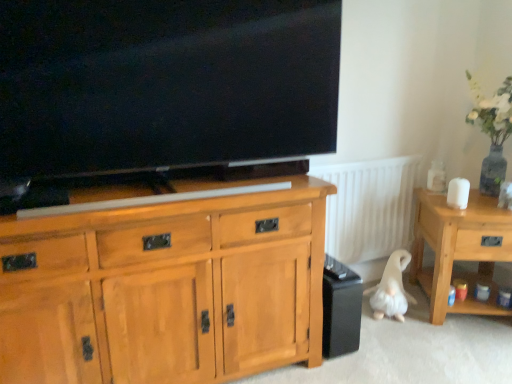
In order to face white plush dog at lower right, should I rotate leftwards or rightwards?

Rotate your view right by about 17.616°.

Measure the distance between point [387,264] and camera.

The distance of point [387,264] from camera is 7.54 feet.

Describe the element at coordinates (459, 249) in the screenshot. I see `light wood side table at right` at that location.

You are a GUI agent. You are given a task and a screenshot of the screen. Output one action in this format:
    pyautogui.click(x=<x>, y=<y>)
    Task: Click on the black matte speaker at lower right
    Image resolution: width=512 pixels, height=384 pixels.
    Given the screenshot: What is the action you would take?
    coord(341,308)

Is matte black tv at upper center placed right next to light brown wood cabinet at center?

No, matte black tv at upper center is not touching light brown wood cabinet at center.

From the image's perspective, relative to light brown wood cabinet at center, is matte black tv at upper center above or below?

matte black tv at upper center is situated higher than light brown wood cabinet at center in the image.

Does matte black tv at upper center appear on the left side of light brown wood cabinet at center?

No.

Can you confirm if matte black tv at upper center is smaller than light brown wood cabinet at center?

Indeed, matte black tv at upper center has a smaller size compared to light brown wood cabinet at center.

Considering the relative sizes of white ribbed radiator at center and light brown wood cabinet at center in the image provided, is white ribbed radiator at center taller than light brown wood cabinet at center?

No, white ribbed radiator at center is not taller than light brown wood cabinet at center.

Is white ribbed radiator at center completely or partially outside of light brown wood cabinet at center?

Yes, white ribbed radiator at center is located beyond the bounds of light brown wood cabinet at center.

Could you tell me if white ribbed radiator at center is turned towards light brown wood cabinet at center?

No, white ribbed radiator at center does not turn towards light brown wood cabinet at center.

Identify the location of cabinetry that is below the white ribbed radiator at center (from the image's perspective). (165, 288).

Consider the image. Considering the relative sizes of white plush dog at lower right and light brown wood cabinet at center in the image provided, is white plush dog at lower right wider than light brown wood cabinet at center?

No.

From the image's perspective, which is above, white plush dog at lower right or light brown wood cabinet at center?

light brown wood cabinet at center appears higher in the image.

Where is `animal on the right of the light brown wood cabinet at center`? animal on the right of the light brown wood cabinet at center is located at coordinates (391, 289).

Is white plush dog at lower right directly adjacent to light brown wood cabinet at center?

No.

Considering the points (368, 220) and (434, 267), which point is behind, point (368, 220) or point (434, 267)?

The point (368, 220) is farther from the camera.

Consider the image. Which object is further away from the camera, white ribbed radiator at center or light wood side table at right?

white ribbed radiator at center is further from the camera.

From the image's perspective, would you say white ribbed radiator at center is shown under light wood side table at right?

No.

Measure the distance between white ribbed radiator at center and light wood side table at right.

white ribbed radiator at center is 13.37 inches away from light wood side table at right.

Considering the sizes of objects light brown wood cabinet at center and matte black tv at upper center in the image provided, who is wider, light brown wood cabinet at center or matte black tv at upper center?

light brown wood cabinet at center is wider.

Is light brown wood cabinet at center oriented away from matte black tv at upper center?

No, light brown wood cabinet at center is not facing the opposite direction of matte black tv at upper center.

Where is `cabinetry below the matte black tv at upper center (from the image's perspective)`? The height and width of the screenshot is (384, 512). cabinetry below the matte black tv at upper center (from the image's perspective) is located at coordinates (165, 288).

Where is `animal to the right of black matte speaker at lower right`? The image size is (512, 384). animal to the right of black matte speaker at lower right is located at coordinates (391, 289).

Is white plush dog at lower right a part of black matte speaker at lower right?

Actually, white plush dog at lower right is outside black matte speaker at lower right.

From the picture: From a real-world perspective, does black matte speaker at lower right sit lower than white plush dog at lower right?

Actually, black matte speaker at lower right is physically above white plush dog at lower right in the real world.

Is black matte speaker at lower right far away from white plush dog at lower right?

black matte speaker at lower right is actually quite close to white plush dog at lower right.

Does light wood side table at right appear on the right side of white plush dog at lower right?

Yes, light wood side table at right is to the right of white plush dog at lower right.

Is light wood side table at right positioned before white plush dog at lower right?

Yes.

Which of these two, light wood side table at right or white plush dog at lower right, is smaller?

With smaller size is white plush dog at lower right.

Between point (461, 212) and point (396, 258), which one is positioned in front?

The point (461, 212) is closer.

You are a GUI agent. You are given a task and a screenshot of the screen. Output one action in this format:
    pyautogui.click(x=<x>, y=<y>)
    Task: Click on the television in front of the light brown wood cabinet at center
    Image resolution: width=512 pixels, height=384 pixels.
    Given the screenshot: What is the action you would take?
    pyautogui.click(x=160, y=88)

Identify the location of cabinetry below the white ribbed radiator at center (from the image's perspective). This screenshot has width=512, height=384. (165, 288).

Based on their spatial positions, is black matte speaker at lower right or light wood side table at right closer to matte black tv at upper center?

black matte speaker at lower right lies closer to matte black tv at upper center than the other object.

When comparing their distances from white ribbed radiator at center, does black matte speaker at lower right or light brown wood cabinet at center seem closer?

black matte speaker at lower right lies closer to white ribbed radiator at center than the other object.

Looking at the image, which one is located closer to black matte speaker at lower right, light brown wood cabinet at center or light wood side table at right?

Based on the image, light wood side table at right appears to be nearer to black matte speaker at lower right.

When comparing their distances from white ribbed radiator at center, does light brown wood cabinet at center or white plush dog at lower right seem further?

light brown wood cabinet at center.

Which object lies further to the anchor point white ribbed radiator at center, white plush dog at lower right or light brown wood cabinet at center?

Among the two, light brown wood cabinet at center is located further to white ribbed radiator at center.

Looking at the image, which one is located further to matte black tv at upper center, light wood side table at right or light brown wood cabinet at center?

Based on the image, light wood side table at right appears to be further to matte black tv at upper center.

In the scene shown: Which object lies further to the anchor point matte black tv at upper center, white ribbed radiator at center or white plush dog at lower right?

The object further to matte black tv at upper center is white plush dog at lower right.

Estimate the real-world distances between objects in this image. Which object is closer to black matte speaker at lower right, light brown wood cabinet at center or matte black tv at upper center?

light brown wood cabinet at center is closer to black matte speaker at lower right.

I want to click on animal between white ribbed radiator at center and light wood side table at right in the horizontal direction, so click(x=391, y=289).

Identify the location of animal between white ribbed radiator at center and black matte speaker at lower right in the vertical direction. This screenshot has height=384, width=512. (391, 289).

At what (x,y) coordinates should I click in order to perform the action: click on animal situated between black matte speaker at lower right and light wood side table at right from left to right. Please return your answer as a coordinate pair (x, y). The width and height of the screenshot is (512, 384). Looking at the image, I should click on (391, 289).

Identify the location of loudspeaker between light brown wood cabinet at center and white ribbed radiator at center in the horizontal direction. (341, 308).